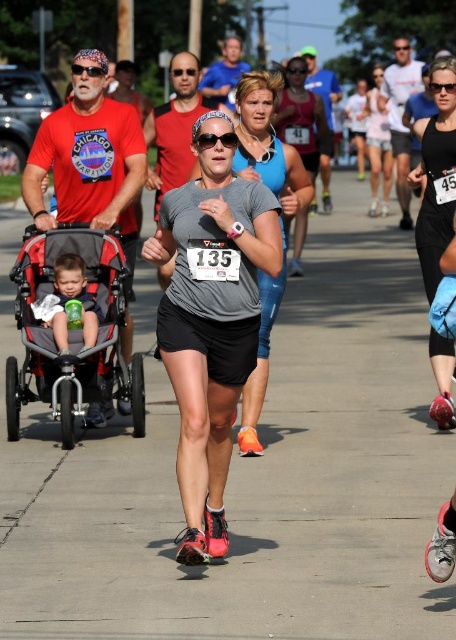
You are a photographer at the running event. You want to capture a photo of the gray fabric stroller at left and the gray matte tank top at center without any overlap. Given that your camera frame can only accommodate objects up to the combined width of both items, will you need to adjust your position or zoom level?

The gray fabric stroller at left is wider than the gray matte tank top at center. To capture both without overlap within the camera frame, you would need to adjust your position or zoom level to ensure the total width of both objects fits.

You are a participant in the running event and see the point marked at coordinate (300, 116). What object is located at that point?

The point at coordinate (300, 116) corresponds to the matte blue tank top at center.